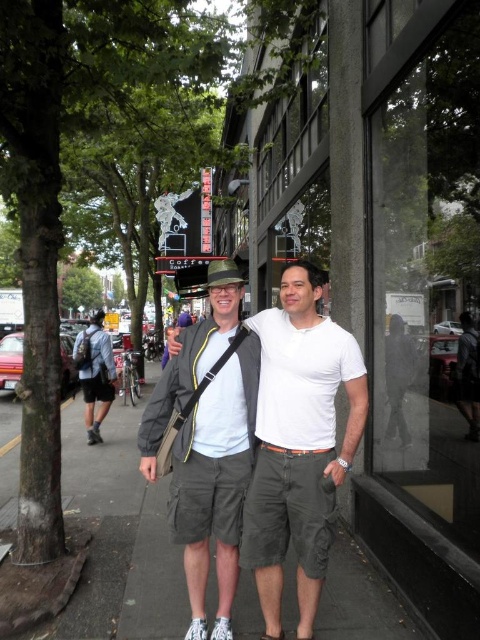
You are a street photographer who wants to capture a photo of the matte gray shorts at center and the denim backpack at left. Based on their positions, which object should you focus on first if you want to include both in the frame without moving the camera?

The denim backpack at left should be focused on first since it is positioned to the left of the matte gray shorts at center, allowing the photographer to frame both objects by starting with the leftmost item.

You are a delivery robot that needs to place a package on the gray concrete sidewalk at center. You are currently holding the package and standing at the matte gray shorts at center. Can you reach the sidewalk without moving more than 4 meters?

The gray concrete sidewalk at center and matte gray shorts at center are 4.33 meters apart, so the robot would need to move 4.33 meters, which is more than 4 meters. Therefore, the robot cannot reach the sidewalk without moving more than 4 meters.